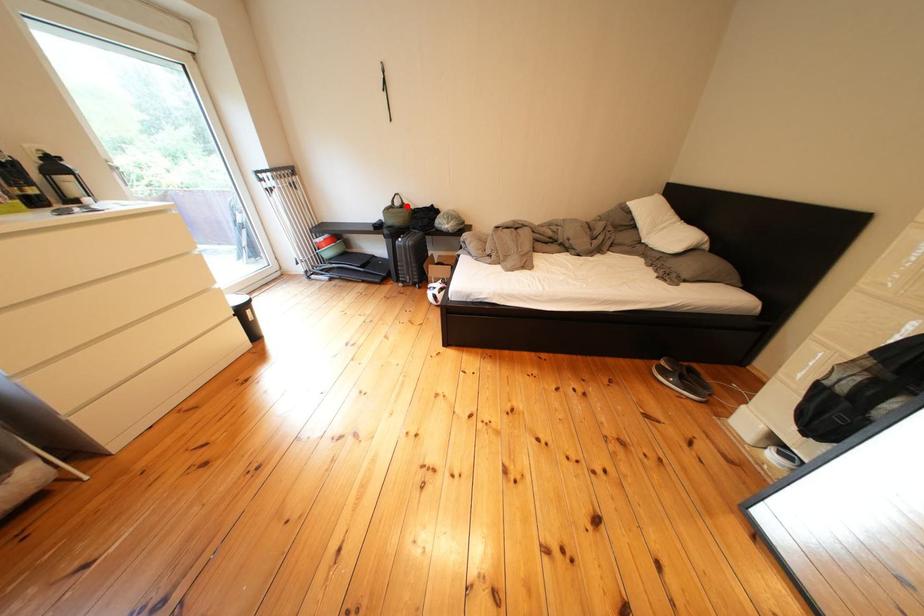
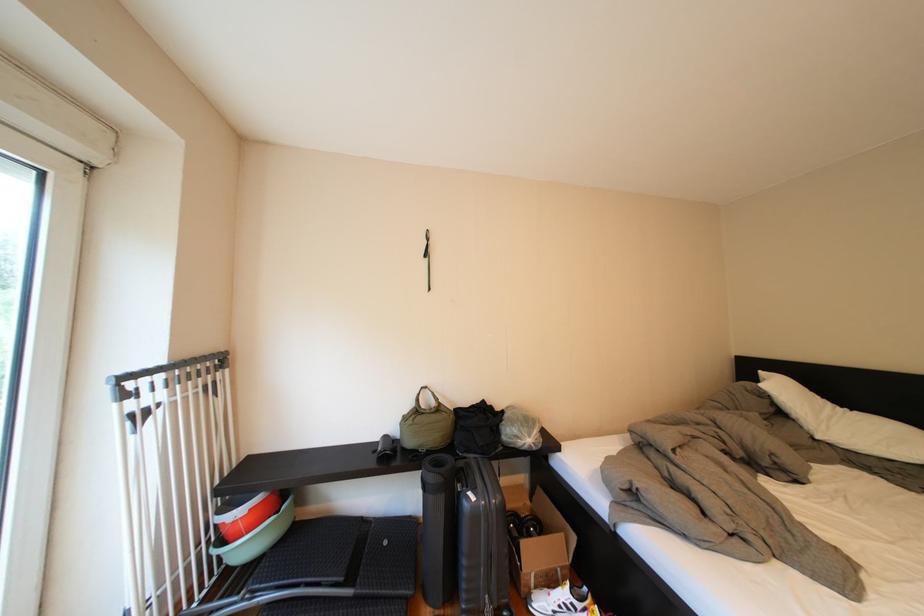
In the second image, find the point that corresponds to the highlighted location in the first image.

(431, 405)